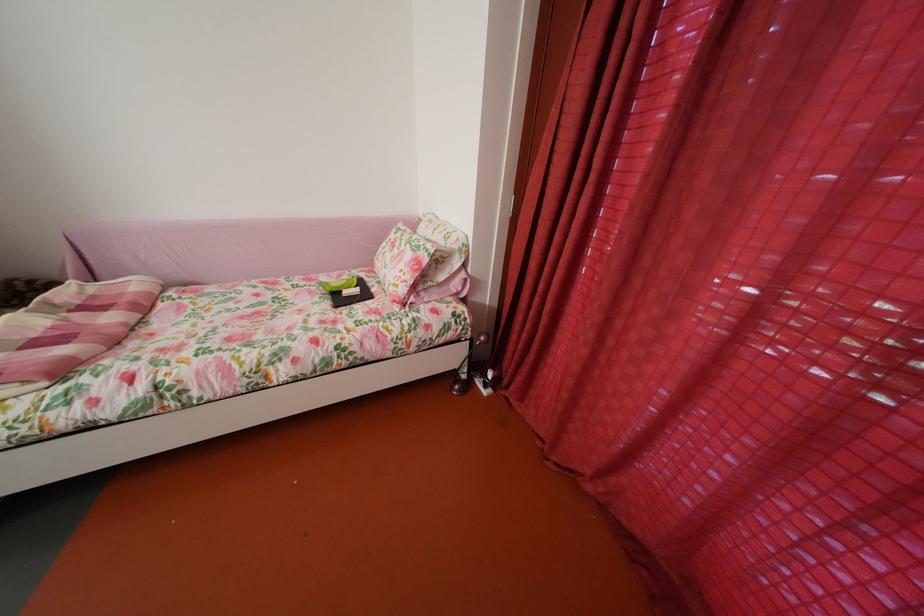
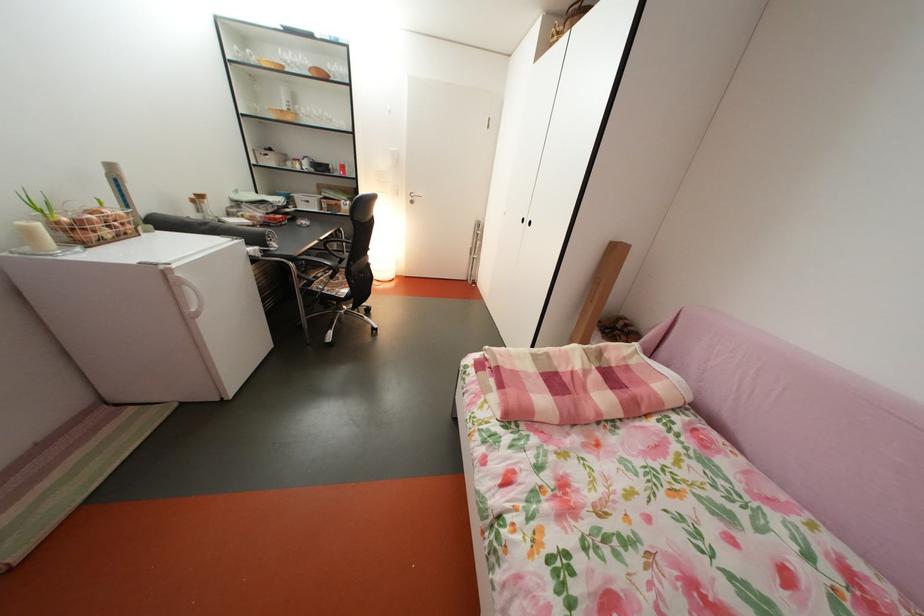
In the second image, find the point that corresponds to the point at 77,321 in the first image.

(604, 374)